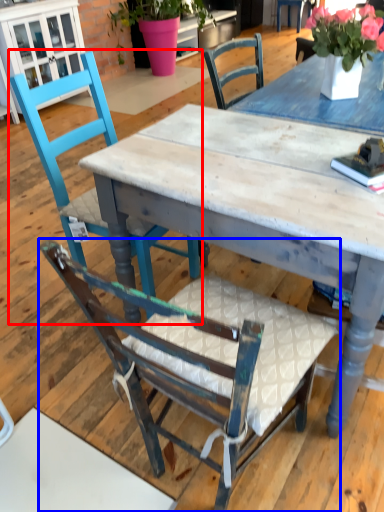
Question: Among these objects, which one is farthest to the camera, chair (highlighted by a red box) or chair (highlighted by a blue box)?

Choices:
 (A) chair
 (B) chair

Answer: (A)